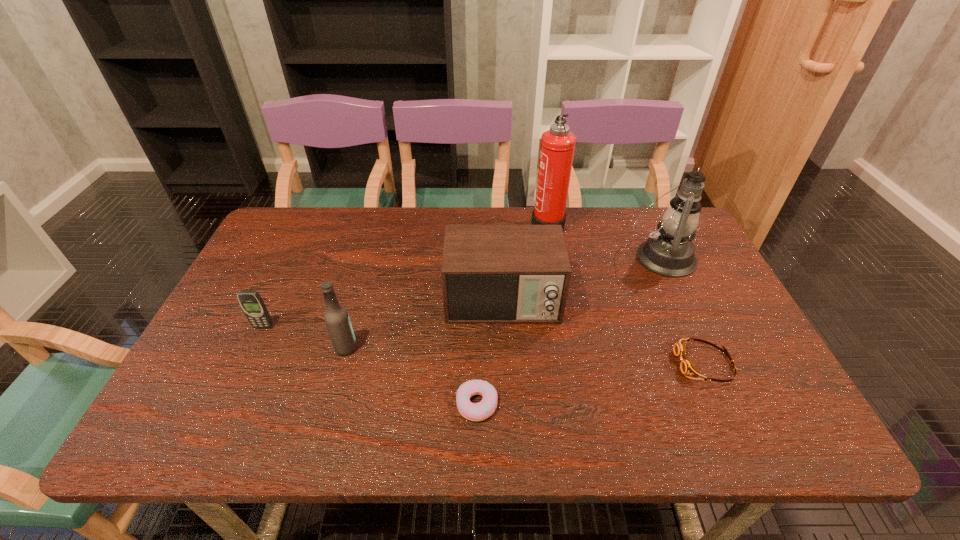
You are a GUI agent. You are given a task and a screenshot of the screen. Output one action in this format:
    pyautogui.click(x=<x>, y=<y>)
    Task: Click on the blank space at the left edge of the desktop
    
    Given the screenshot: What is the action you would take?
    pos(245,388)

Where is `vacant space at the right edge of the desktop`? Image resolution: width=960 pixels, height=540 pixels. vacant space at the right edge of the desktop is located at coordinates (719, 328).

The width and height of the screenshot is (960, 540). In the image, there is a desktop. In order to click on vacant space at the far left corner in this screenshot , I will do `click(270, 246)`.

You are a GUI agent. You are given a task and a screenshot of the screen. Output one action in this format:
    pyautogui.click(x=<x>, y=<y>)
    Task: Click on the vacant space in between the sixth object from right to left and the nearest object
    The height and width of the screenshot is (540, 960).
    Given the screenshot: What is the action you would take?
    pyautogui.click(x=412, y=376)

This screenshot has width=960, height=540. Find the location of `free space between the radio receiver and the leftmost object`. free space between the radio receiver and the leftmost object is located at coordinates (383, 314).

The image size is (960, 540). I want to click on unoccupied position between the fourth shortest object and the oil lamp, so click(582, 279).

This screenshot has width=960, height=540. Find the location of `free space between the oil lamp and the fire extinguisher`. free space between the oil lamp and the fire extinguisher is located at coordinates (604, 240).

Locate an element on the screen. This screenshot has width=960, height=540. free point between the fifth tallest object and the goggles is located at coordinates (484, 345).

At what (x,y) coordinates should I click in order to perform the action: click on vacant region between the tallest object and the goggles. Please return your answer as a coordinate pair (x, y). The height and width of the screenshot is (540, 960). Looking at the image, I should click on (626, 294).

Where is `unoccupied position between the fire extinguisher and the second tallest object`? The height and width of the screenshot is (540, 960). unoccupied position between the fire extinguisher and the second tallest object is located at coordinates (604, 240).